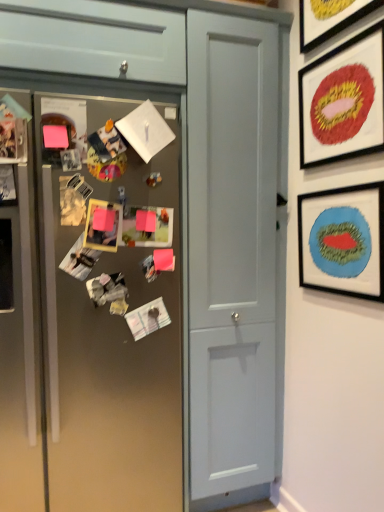
Question: From the image's perspective, is matte red lips at upper right, acting as the second picture frame starting from the top, positioned above or below brushed metal cabinet at upper left?

Choices:
 (A) above
 (B) below

Answer: (B)

Question: In terms of width, does matte red lips at upper right, the 2th picture frame when ordered from bottom to top, look wider or thinner when compared to brushed metal cabinet at upper left?

Choices:
 (A) thin
 (B) wide

Answer: (A)

Question: Estimate the real-world distances between objects in this image. Which object is farther from the matte gray door at center?

Choices:
 (A) matte red lips at upper right, the 2th picture frame when ordered from bottom to top
 (B) metallic silver photo frame at left, the 2th art from the back
 (C) metallic gray fridge at left
 (D) yellow matte picture frame at upper right, which appears as the 1th picture frame when viewed from the top
 (E) blue matte picture frame at right, marked as the first picture frame in a bottom-to-top arrangement

Answer: (D)

Question: Estimate the real-world distances between objects in this image. Which object is closer to the brushed metal cabinet at upper left?

Choices:
 (A) matte gray door at center
 (B) matte red lips at upper right, the 2th picture frame when ordered from bottom to top
 (C) metallic silver photo frame at center, the second art viewed from the front
 (D) metallic gray fridge at left
 (E) blue matte picture frame at right, marked as the first picture frame in a bottom-to-top arrangement

Answer: (A)